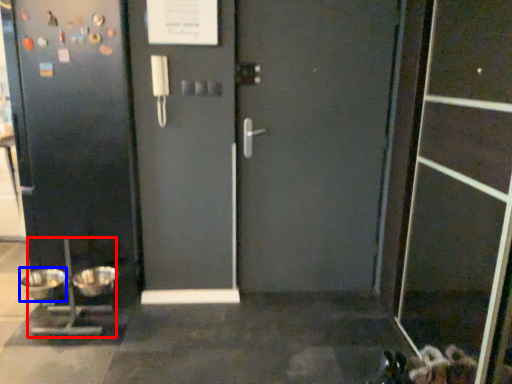
Question: Which point is further to the camera, appliance (highlighted by a red box) or mixing bowl (highlighted by a blue box)?

Choices:
 (A) appliance
 (B) mixing bowl

Answer: (B)